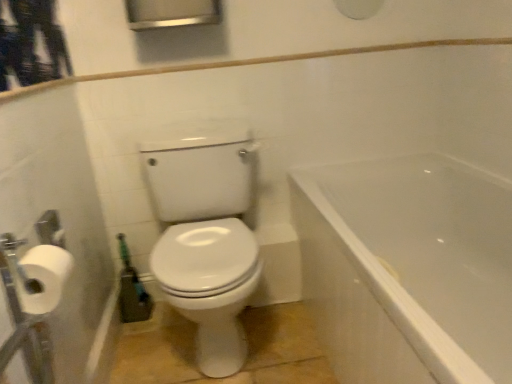
Question: Considering the relative sizes of white matte toilet paper at left and white glossy bathtub at right in the image provided, is white matte toilet paper at left bigger than white glossy bathtub at right?

Choices:
 (A) yes
 (B) no

Answer: (B)

Question: Is white matte toilet paper at left smaller than white glossy bathtub at right?

Choices:
 (A) yes
 (B) no

Answer: (A)

Question: Considering the relative positions of white matte toilet paper at left and white glossy bathtub at right in the image provided, is white matte toilet paper at left to the right of white glossy bathtub at right from the viewer's perspective?

Choices:
 (A) yes
 (B) no

Answer: (B)

Question: Is white matte toilet paper at left positioned before white glossy bathtub at right?

Choices:
 (A) yes
 (B) no

Answer: (B)

Question: Are white matte toilet paper at left and white glossy bathtub at right far apart?

Choices:
 (A) yes
 (B) no

Answer: (A)

Question: Is white matte toilet paper at left thinner than white glossy bathtub at right?

Choices:
 (A) no
 (B) yes

Answer: (B)

Question: Is white glossy bathtub at right looking in the opposite direction of white matte toilet paper at left?

Choices:
 (A) no
 (B) yes

Answer: (A)

Question: Does white glossy bathtub at right have a lesser width compared to white matte toilet paper at left?

Choices:
 (A) yes
 (B) no

Answer: (B)

Question: From a real-world perspective, is white glossy bathtub at right located beneath white matte toilet paper at left?

Choices:
 (A) no
 (B) yes

Answer: (B)

Question: Is white glossy bathtub at right next to white matte toilet paper at left?

Choices:
 (A) no
 (B) yes

Answer: (A)

Question: Is the depth of white glossy bathtub at right greater than that of white matte toilet paper at left?

Choices:
 (A) yes
 (B) no

Answer: (B)

Question: From the image's perspective, is white glossy bathtub at right located beneath white matte toilet paper at left?

Choices:
 (A) no
 (B) yes

Answer: (B)

Question: From a real-world perspective, is white glossy bathtub at right positioned above or below white matte toilet paper at left?

Choices:
 (A) below
 (B) above

Answer: (A)